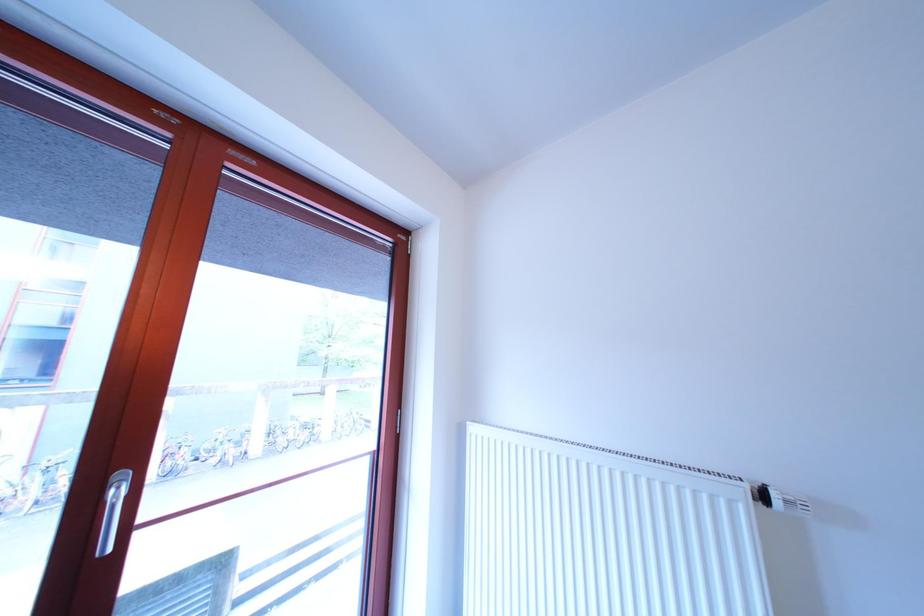
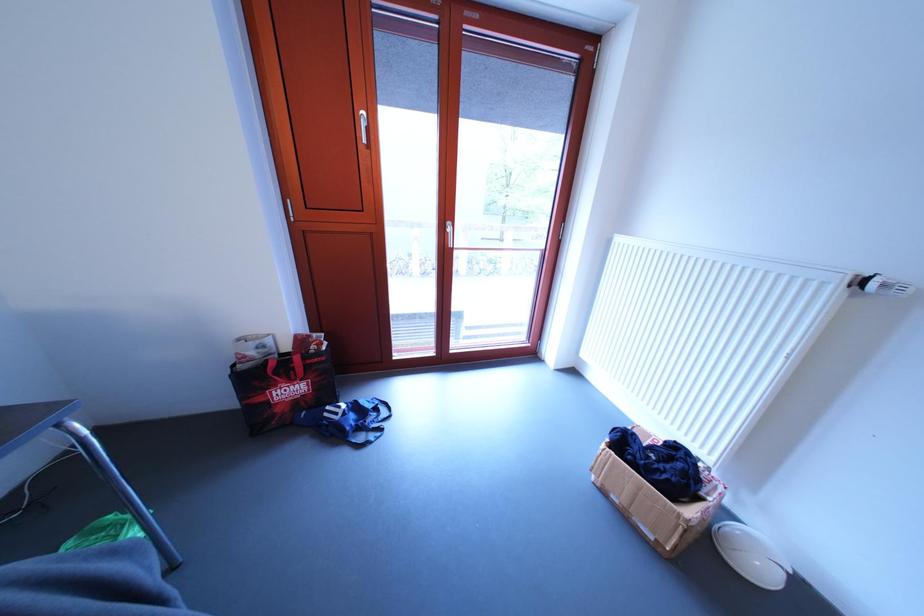
Based on the continuous images, in which direction is the camera rotating?

The rotation direction of the camera is left-down.